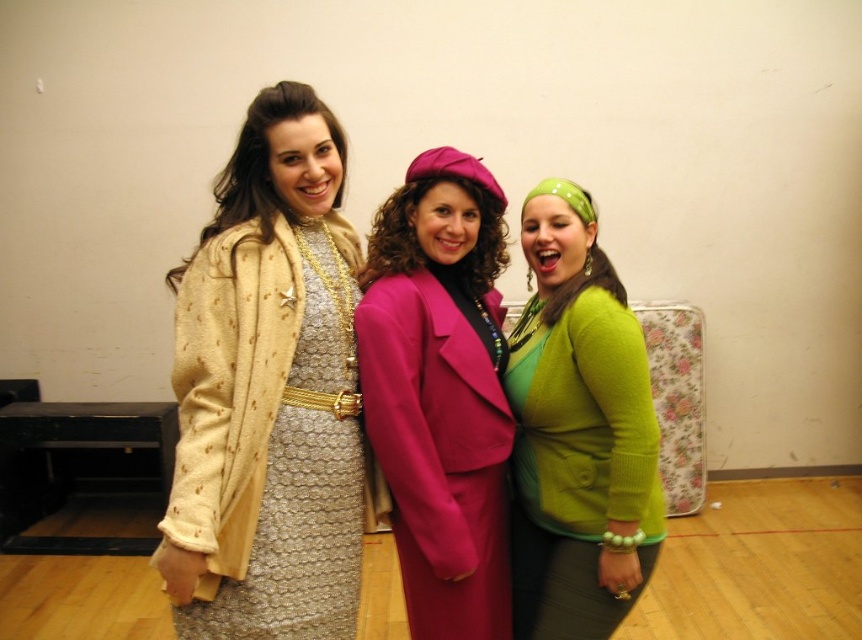
Who is taller, matte pink coat at center or green fuzzy sweater at center?

With more height is matte pink coat at center.

Can you confirm if matte pink coat at center is thinner than green fuzzy sweater at center?

Correct, matte pink coat at center's width is less than green fuzzy sweater at center's.

Is point (478, 252) positioned behind point (528, 330)?

That is False.

This screenshot has width=862, height=640. Identify the location of matte pink coat at center. (440, 392).

Can you confirm if gold textured dress at center is thinner than green fuzzy sweater at center?

No.

Does gold textured dress at center appear over green fuzzy sweater at center?

Incorrect, gold textured dress at center is not positioned above green fuzzy sweater at center.

The width and height of the screenshot is (862, 640). Identify the location of gold textured dress at center. (269, 433).

Find the location of a particular element. This screenshot has width=862, height=640. gold textured dress at center is located at coordinates (269, 433).

Is gold textured dress at center below matte pink coat at center?

Indeed, gold textured dress at center is positioned under matte pink coat at center.

Does gold textured dress at center have a greater width compared to matte pink coat at center?

Yes, gold textured dress at center is wider than matte pink coat at center.

This screenshot has height=640, width=862. In order to click on gold textured dress at center in this screenshot , I will do [269, 433].